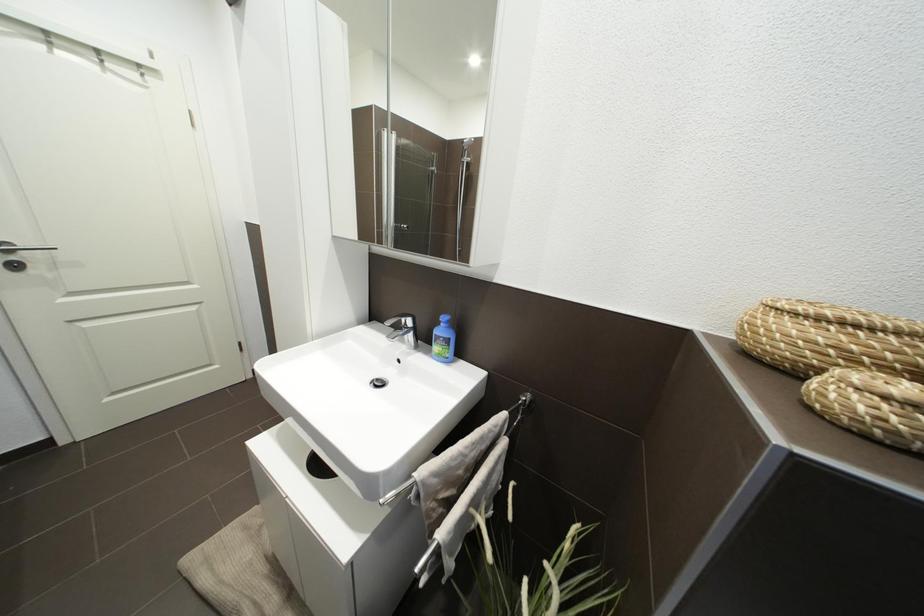
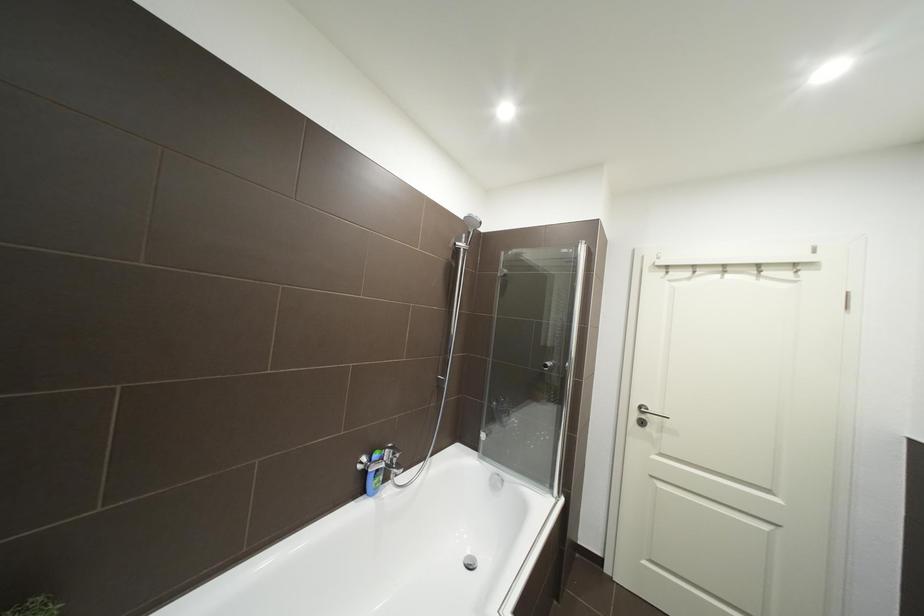
Question: How did the camera likely rotate?

Choices:
 (A) Left
 (B) Right
 (C) Up
 (D) Down

Answer: (A)